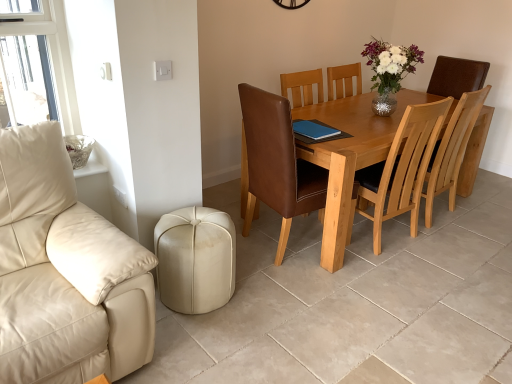
Question: Which direction should I rotate to face brown leather chair at center, the 2th chair positioned from the right, — up or down?

Choices:
 (A) down
 (B) up

Answer: (B)

Question: Is light brown wooden table at center closer to camera compared to brown leather chair at center, the 2th chair positioned from the right?

Choices:
 (A) no
 (B) yes

Answer: (A)

Question: Is light brown wooden table at center taller than brown leather chair at center, the 2th chair positioned from the right?

Choices:
 (A) no
 (B) yes

Answer: (A)

Question: Is light brown wooden table at center turned away from brown leather chair at center, the first chair positioned from the left?

Choices:
 (A) no
 (B) yes

Answer: (A)

Question: Can you confirm if light brown wooden table at center is smaller than brown leather chair at center, the 2th chair positioned from the right?

Choices:
 (A) yes
 (B) no

Answer: (B)

Question: Is light brown wooden table at center at the right side of brown leather chair at center, the first chair positioned from the left?

Choices:
 (A) no
 (B) yes

Answer: (B)

Question: Is light brown wooden table at center shorter than brown leather chair at center, the first chair positioned from the left?

Choices:
 (A) yes
 (B) no

Answer: (A)

Question: Is brown leather chair at center, the 2th chair positioned from the right, taller than light brown wood chair at center, acting as the 1th chair starting from the right?

Choices:
 (A) no
 (B) yes

Answer: (B)

Question: Is brown leather chair at center, the first chair positioned from the left, outside of light brown wood chair at center, which ranks as the second chair in left-to-right order?

Choices:
 (A) no
 (B) yes

Answer: (B)

Question: From a real-world perspective, is brown leather chair at center, the 2th chair positioned from the right, on light brown wood chair at center, which ranks as the second chair in left-to-right order?

Choices:
 (A) yes
 (B) no

Answer: (A)

Question: Does brown leather chair at center, the first chair positioned from the left, have a greater width compared to light brown wood chair at center, acting as the 1th chair starting from the right?

Choices:
 (A) yes
 (B) no

Answer: (A)

Question: Could you tell me if brown leather chair at center, the first chair positioned from the left, is facing light brown wood chair at center, acting as the 1th chair starting from the right?

Choices:
 (A) no
 (B) yes

Answer: (B)

Question: From a real-world perspective, is brown leather chair at center, the first chair positioned from the left, under light brown wood chair at center, acting as the 1th chair starting from the right?

Choices:
 (A) yes
 (B) no

Answer: (B)

Question: Is shiny silver vase at upper center placed right next to blue leather pad at center?

Choices:
 (A) yes
 (B) no

Answer: (B)